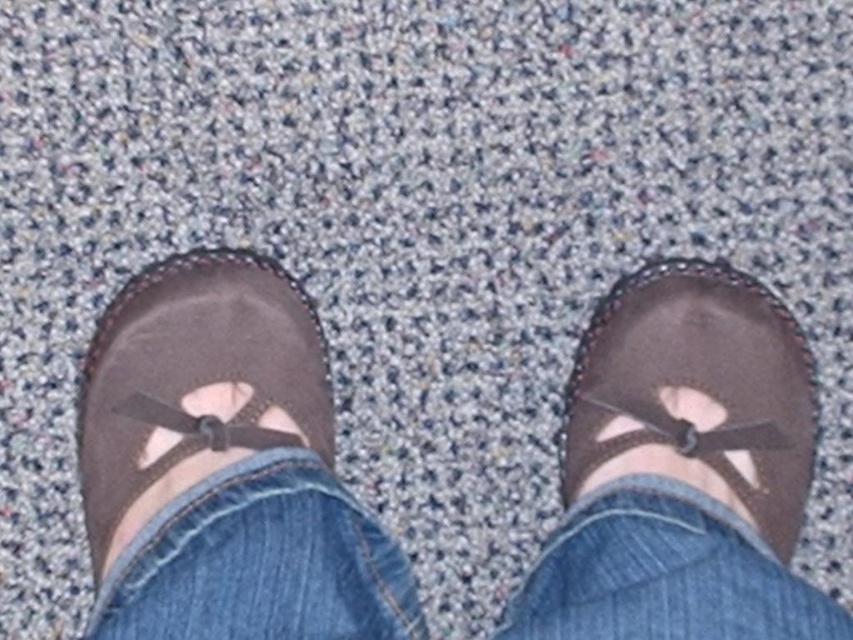
Question: Where is brown suede shoes at center located in relation to brown leather shoe at center in the image?

Choices:
 (A) right
 (B) left

Answer: (B)

Question: Which object is the farthest from the denim at center?

Choices:
 (A) brown suede shoes at center
 (B) brown suede shoe at left

Answer: (B)

Question: Which is nearer to the brown suede shoe at left?

Choices:
 (A) brown leather shoe at center
 (B) brown suede shoes at center
 (C) denim at center

Answer: (B)

Question: Is brown suede shoes at center smaller than denim at center?

Choices:
 (A) yes
 (B) no

Answer: (B)

Question: Can you confirm if brown leather shoe at center is smaller than brown suede shoe at left?

Choices:
 (A) yes
 (B) no

Answer: (A)

Question: Which point is closer to the camera taking this photo?

Choices:
 (A) (120, 506)
 (B) (664, 320)

Answer: (A)